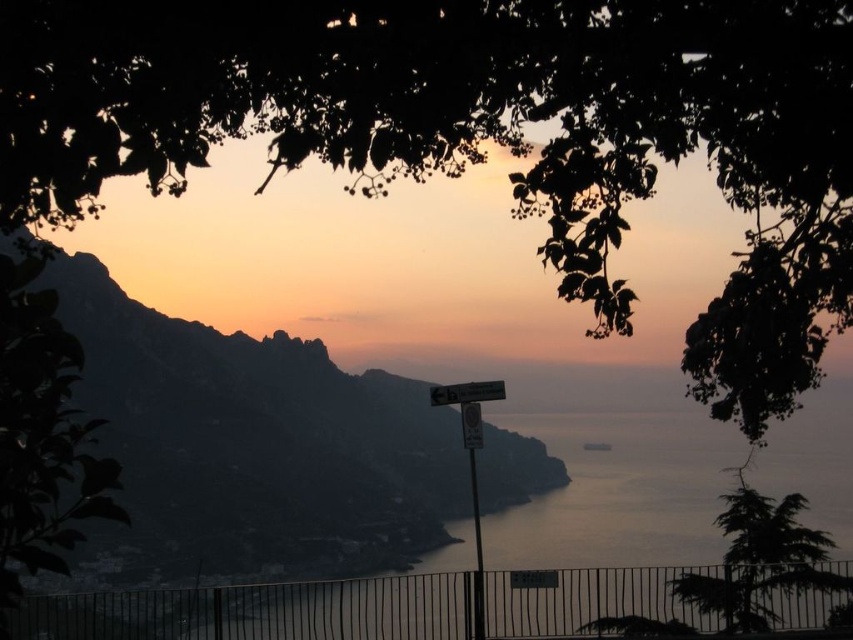
Question: Which point is closer to the camera?

Choices:
 (A) [787, 522]
 (B) [149, 88]
 (C) [515, 442]

Answer: (B)

Question: Estimate the real-world distances between objects in this image. Which object is farther from the metallic sign at center?

Choices:
 (A) green leafy tree at upper center
 (B) green textured tree at lower right
 (C) white plastic sign at center

Answer: (A)

Question: Can you confirm if green leafy tree at upper center is bigger than silvery water at center?

Choices:
 (A) no
 (B) yes

Answer: (B)

Question: Which point is closer to the camera?

Choices:
 (A) silvery metallic mountain at center
 (B) green textured tree at lower right

Answer: (A)

Question: Does green leafy tree at upper center have a lesser width compared to white plastic sign at center?

Choices:
 (A) yes
 (B) no

Answer: (B)

Question: Is green leafy tree at upper center above white plastic sign at center?

Choices:
 (A) no
 (B) yes

Answer: (B)